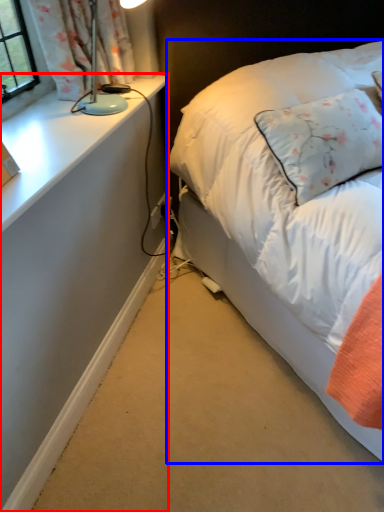
Question: Which object appears closest to the camera in this image, desk (highlighted by a red box) or bed (highlighted by a blue box)?

Choices:
 (A) desk
 (B) bed

Answer: (B)